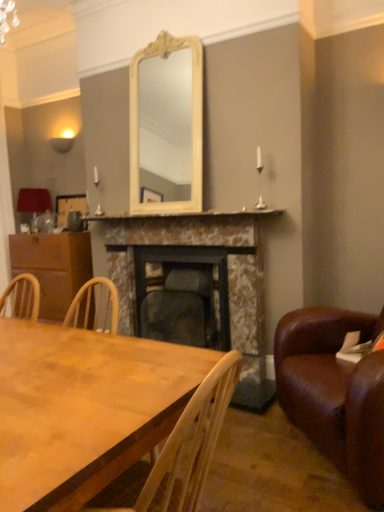
Question: Considering the positions of point (165, 222) and point (160, 236), is point (165, 222) closer or farther from the camera than point (160, 236)?

Choices:
 (A) farther
 (B) closer

Answer: (B)

Question: Visually, is marble mantelpiece at center positioned to the left or to the right of marble fireplace at center, the second fireplace viewed from the left?

Choices:
 (A) left
 (B) right

Answer: (A)

Question: Which object is the closest to the marble fireplace at center, the first fireplace when ordered from right to left?

Choices:
 (A) dark gray stone fireplace at center, the 1th fireplace viewed from the left
 (B) brown wood cabinet at left
 (C) matte red lampshade at left
 (D) brown leather couch at right
 (E) marble mantelpiece at center

Answer: (A)

Question: Which object is positioned farthest from the wooden table at lower left?

Choices:
 (A) marble fireplace at center, the first fireplace when ordered from right to left
 (B) brown leather couch at right
 (C) matte red lampshade at left
 (D) dark gray stone fireplace at center, the 1th fireplace viewed from the left
 (E) wooden picture frame at left

Answer: (C)